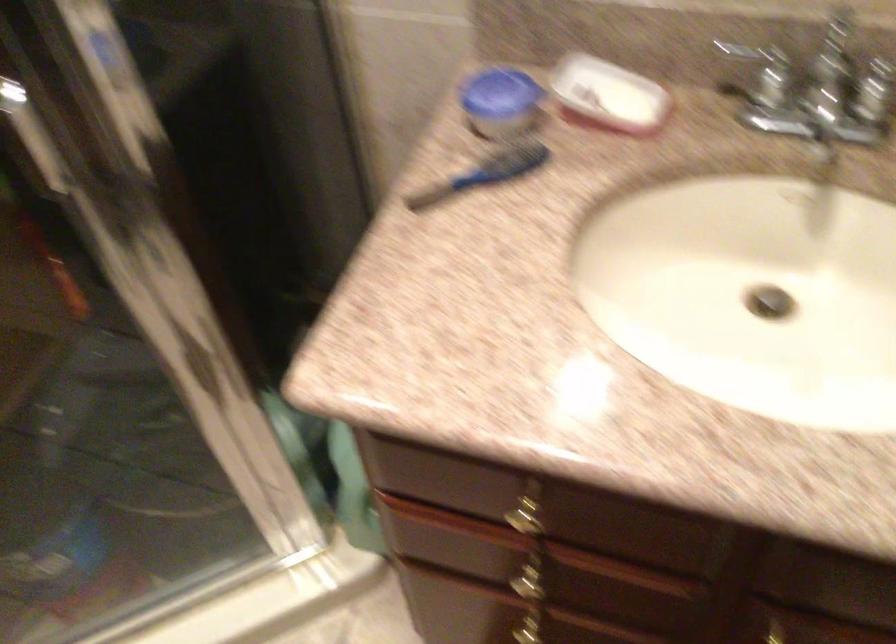
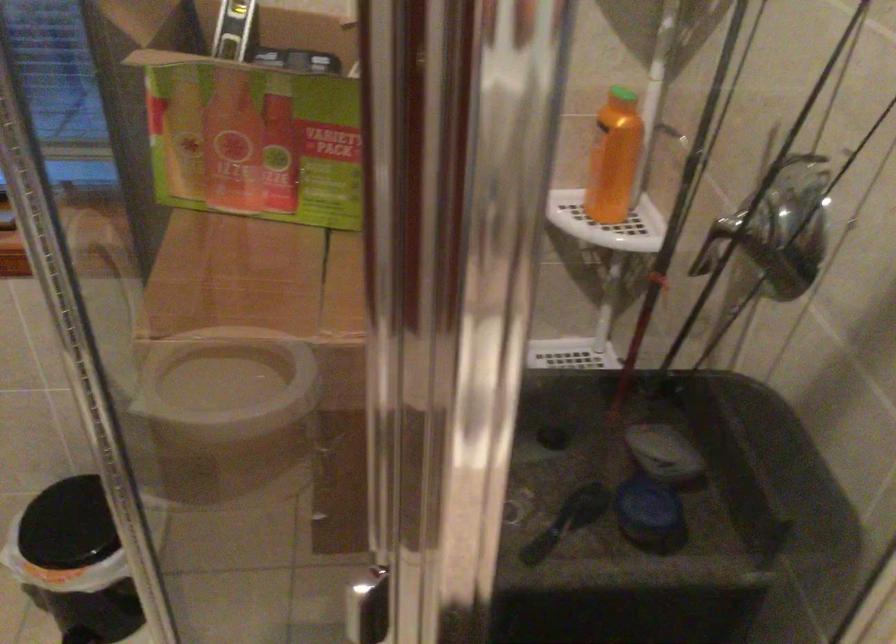
Question: The images are taken continuously from a first-person perspective. In which direction is your viewpoint rotating?

Choices:
 (A) Left
 (B) Right
 (C) Up
 (D) Down

Answer: (A)